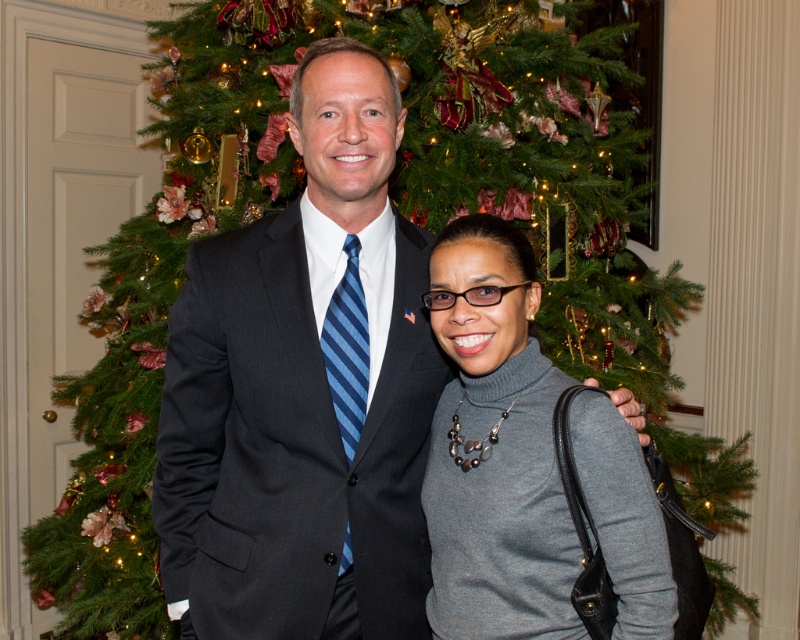
Question: Which point is farther to the camera?

Choices:
 (A) dark gray suit at center
 (B) gray matte turtleneck sweater at center

Answer: (A)

Question: In this image, where is dark gray suit at center located relative to gray matte turtleneck sweater at center?

Choices:
 (A) right
 (B) left

Answer: (B)

Question: Among these objects, which one is nearest to the camera?

Choices:
 (A) gray matte turtleneck sweater at center
 (B) dark gray suit at center

Answer: (A)

Question: Does dark gray suit at center lie behind gray matte turtleneck sweater at center?

Choices:
 (A) yes
 (B) no

Answer: (A)

Question: Among these objects, which one is farthest from the camera?

Choices:
 (A) gray matte turtleneck sweater at center
 (B) dark gray suit at center

Answer: (B)

Question: Is dark gray suit at center further to the viewer compared to gray matte turtleneck sweater at center?

Choices:
 (A) no
 (B) yes

Answer: (B)